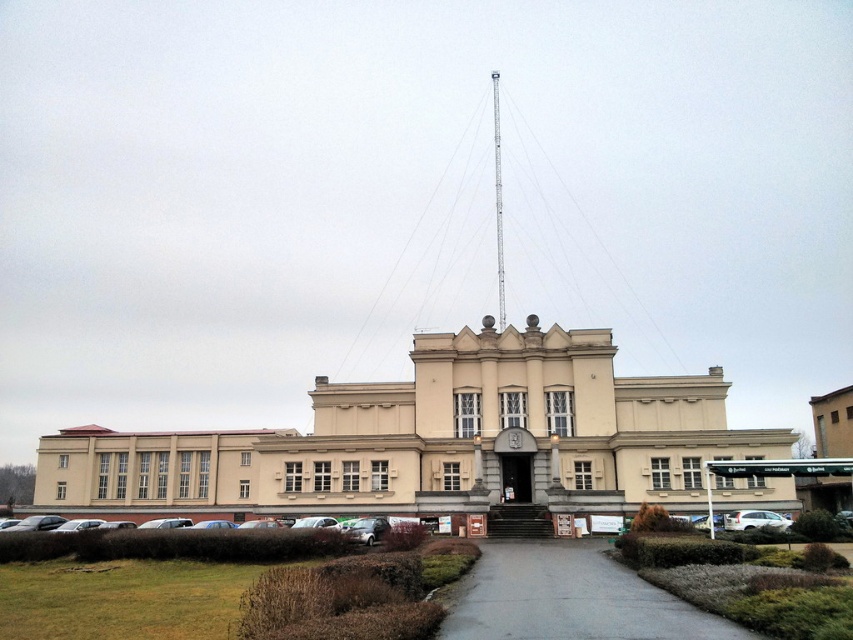
You are a visitor approaching the beige stone building at center and the gray asphalt path at center. Which object is taller?

The beige stone building at center is much taller than the gray asphalt path at center.

You are standing at the entrance of the beige stone building at center. You want to take a photo of the building from a specific point. According to the coordinates given, where should you position yourself relative to the building to capture it perfectly?

The beige stone building at center is positioned at coordinates point (x=440, y=442). To capture it perfectly, you should position yourself directly in front of the building at the central entrance area, as the coordinates indicate the building is centered in the scene.